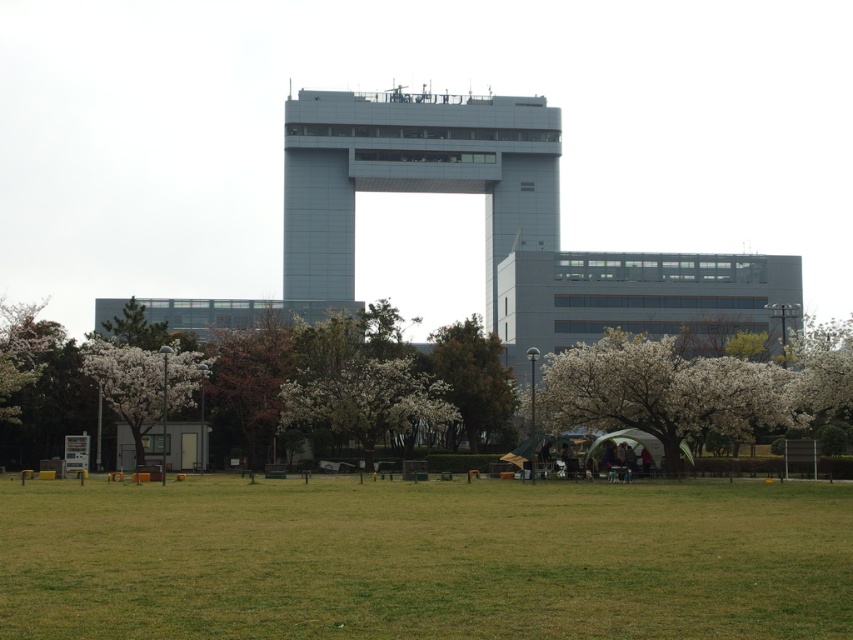
Does green grass at lower center have a smaller size compared to green leafy tree at center?

Incorrect, green grass at lower center is not smaller in size than green leafy tree at center.

Does green grass at lower center have a larger size compared to green leafy tree at center?

Correct, green grass at lower center is larger in size than green leafy tree at center.

Identify the location of green grass at lower center. (424, 560).

Is point (431, 97) positioned in front of point (456, 385)?

No.

Between point (291, 172) and point (432, 346), which one is positioned behind?

The point (291, 172) is behind.

Describe the element at coordinates (413, 173) in the screenshot. This screenshot has width=853, height=640. I see `sleek metallic tower at center` at that location.

Where is `sleek metallic tower at center`? This screenshot has width=853, height=640. sleek metallic tower at center is located at coordinates (413, 173).

Consider the image. Between white blossoming tree at lower right and white blossoming tree at right, which one has more height?

white blossoming tree at right

Can you confirm if white blossoming tree at lower right is positioned above white blossoming tree at right?

No.

Describe the element at coordinates (659, 390) in the screenshot. I see `white blossoming tree at lower right` at that location.

Where is `white blossoming tree at lower right`? The width and height of the screenshot is (853, 640). white blossoming tree at lower right is located at coordinates (659, 390).